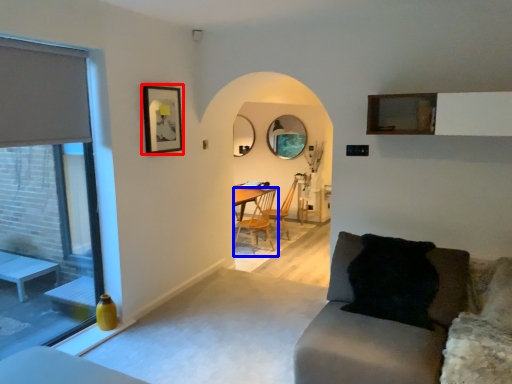
Question: Which of the following is the farthest to the observer, picture frame (highlighted by a red box) or chair (highlighted by a blue box)?

Choices:
 (A) picture frame
 (B) chair

Answer: (B)